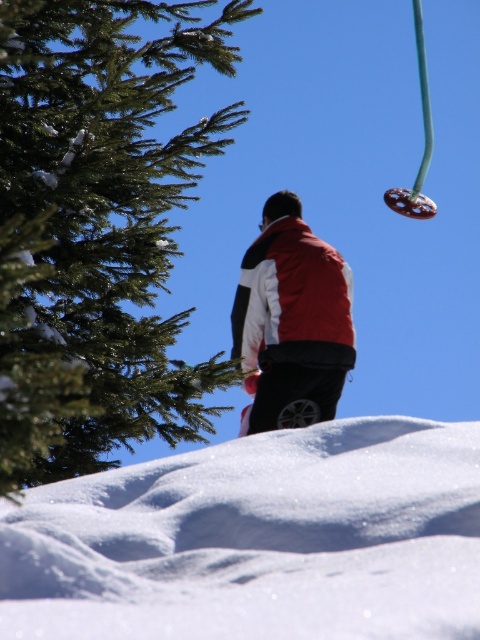
Between white powdery snow at center and green textured pine tree at left, which one has more height?

With more height is green textured pine tree at left.

Locate an element on the screen. The image size is (480, 640). white powdery snow at center is located at coordinates (257, 540).

Image resolution: width=480 pixels, height=640 pixels. Find the location of `white powdery snow at center`. white powdery snow at center is located at coordinates click(257, 540).

Locate an element on the screen. This screenshot has height=640, width=480. white powdery snow at center is located at coordinates (257, 540).

Between green textured pine tree at left and matte red vest at center, which one has more height?

green textured pine tree at left

Is green textured pine tree at left positioned in front of matte red vest at center?

Yes, green textured pine tree at left is closer to the viewer.

You are a GUI agent. You are given a task and a screenshot of the screen. Output one action in this format:
    pyautogui.click(x=<x>, y=<y>)
    Task: Click on the green textured pine tree at left
    
    Given the screenshot: What is the action you would take?
    pyautogui.click(x=97, y=228)

This screenshot has width=480, height=640. What are the coordinates of `green textured pine tree at left` in the screenshot? It's located at (97, 228).

In the scene shown: Is white powdery snow at center closer to camera compared to matte red vest at center?

Yes.

Is white powdery snow at center further to camera compared to matte red vest at center?

No, it is not.

This screenshot has height=640, width=480. What do you see at coordinates (257, 540) in the screenshot? I see `white powdery snow at center` at bounding box center [257, 540].

You are a GUI agent. You are given a task and a screenshot of the screen. Output one action in this format:
    pyautogui.click(x=<x>, y=<y>)
    Task: Click on the white powdery snow at center
    This screenshot has width=480, height=640.
    Given the screenshot: What is the action you would take?
    pyautogui.click(x=257, y=540)